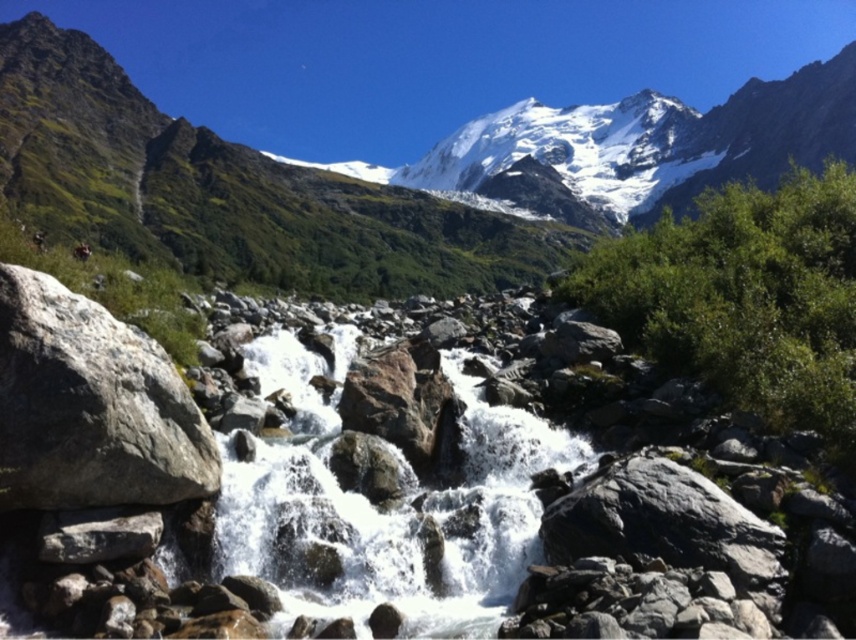
You are a hiker standing at the edge of the riverbed. You see the white frothy water at center and the gray rough rock at left. Which one is taller from your viewpoint?

The white frothy water at center is taller than the gray rough rock at left.